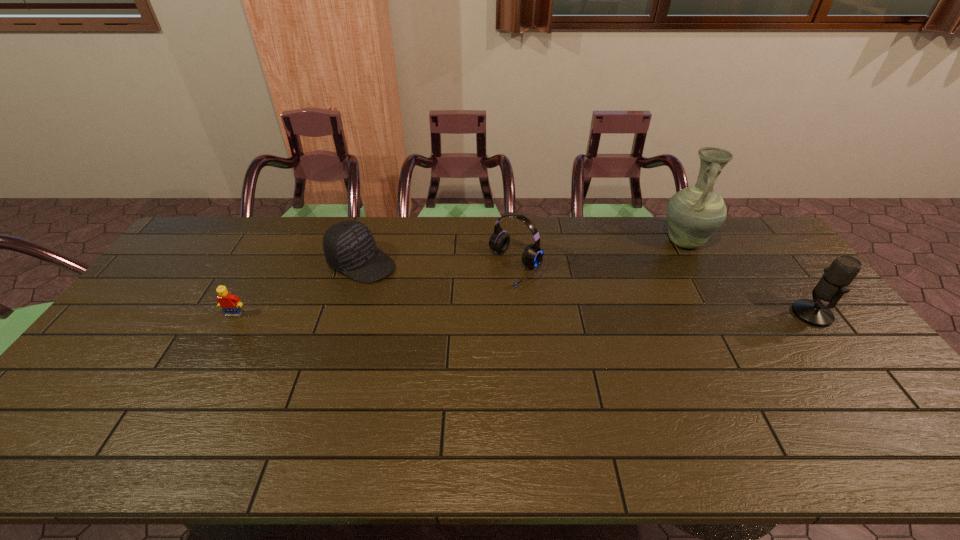
You are a GUI agent. You are given a task and a screenshot of the screen. Output one action in this format:
    pyautogui.click(x=<x>, y=<y>)
    Task: Click on the free space on the desktop that is between the shortest object and the rightmost object and is positioned at the front of the second shortest object where the brim is located
    This screenshot has width=960, height=540.
    Given the screenshot: What is the action you would take?
    pyautogui.click(x=468, y=314)

Locate an element on the screen. This screenshot has width=960, height=540. vacant space on the desktop that is between the leftmost object and the microphone and is positioned on the ear cushions of the headset is located at coordinates (467, 314).

This screenshot has height=540, width=960. Identify the location of free space on the desktop that is between the shortest object and the rightmost object and is positioned on the handle side of the fourth object from left to right. (609, 314).